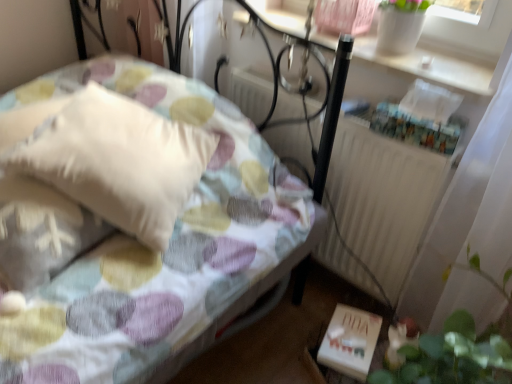
Image resolution: width=512 pixels, height=384 pixels. Find the location of `vacant area on top of white matte book at lower right (from a real-world perspective)`. vacant area on top of white matte book at lower right (from a real-world perspective) is located at coordinates (360, 336).